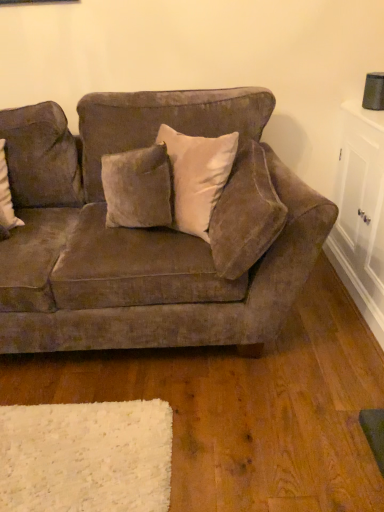
Question: From the image's perspective, is white glossy cabinet at right positioned above or below velvet beige pillow at upper center?

Choices:
 (A) above
 (B) below

Answer: (B)

Question: From a real-world perspective, relative to velvet beige pillow at upper center, is white glossy cabinet at right vertically above or below?

Choices:
 (A) above
 (B) below

Answer: (B)

Question: Estimate the real-world distances between objects in this image. Which object is closer to the velvet beige pillow at upper center?

Choices:
 (A) white glossy cabinet at right
 (B) velvet brown couch at center

Answer: (B)

Question: Which is nearer to the velvet beige pillow at upper center?

Choices:
 (A) velvet brown couch at center
 (B) white glossy cabinet at right

Answer: (A)